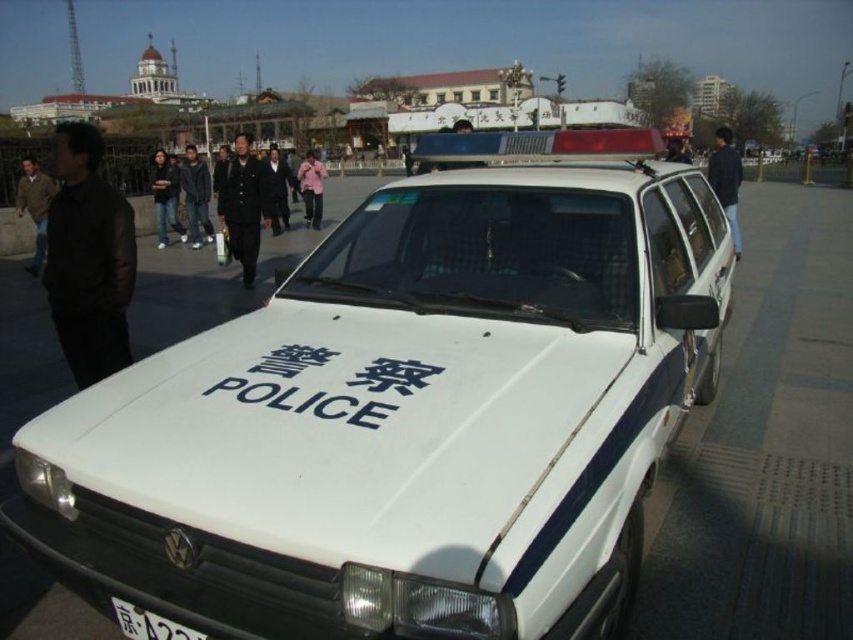
Question: Among these objects, which one is farthest from the camera?

Choices:
 (A) pink fabric jacket at center
 (B) black plastic license plate at lower center

Answer: (A)

Question: Which object is the farthest from the blue jeans at right?

Choices:
 (A) black plastic license plate at lower center
 (B) brown leather jacket at left

Answer: (B)

Question: Which point is farther to the camera?

Choices:
 (A) (683, 154)
 (B) (170, 205)
 (C) (242, 170)
 (D) (427, 385)

Answer: (B)

Question: Is white matte police car at center positioned in front of jeans at center?

Choices:
 (A) no
 (B) yes

Answer: (B)

Question: Does white matte police car at center lie behind black fabric coat at center?

Choices:
 (A) yes
 (B) no

Answer: (B)

Question: Can you confirm if white matte/polished police sign at center is wider than black fabric coat at center?

Choices:
 (A) yes
 (B) no

Answer: (B)